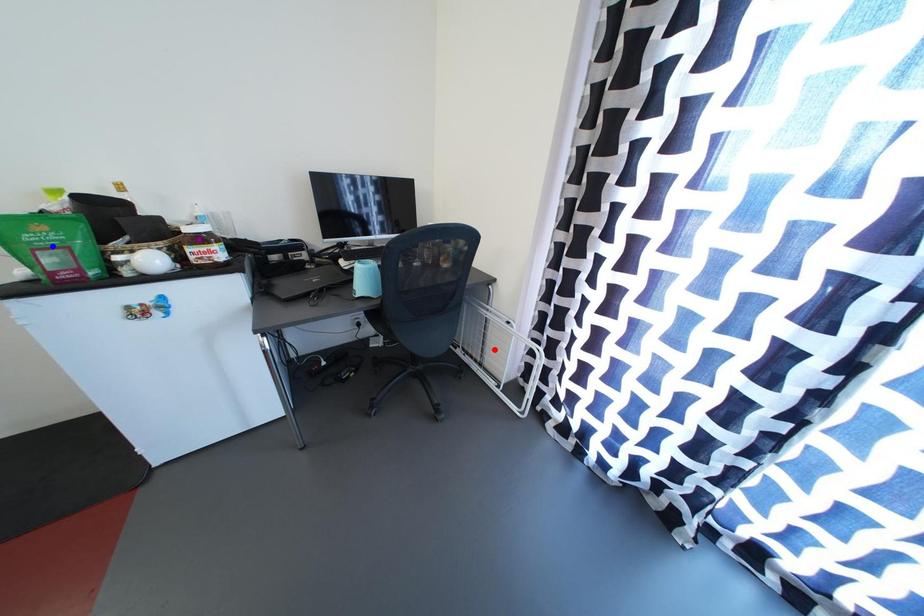
Order these from nearest to farthest:
A) blue point
B) red point
C) purple point

red point → purple point → blue point